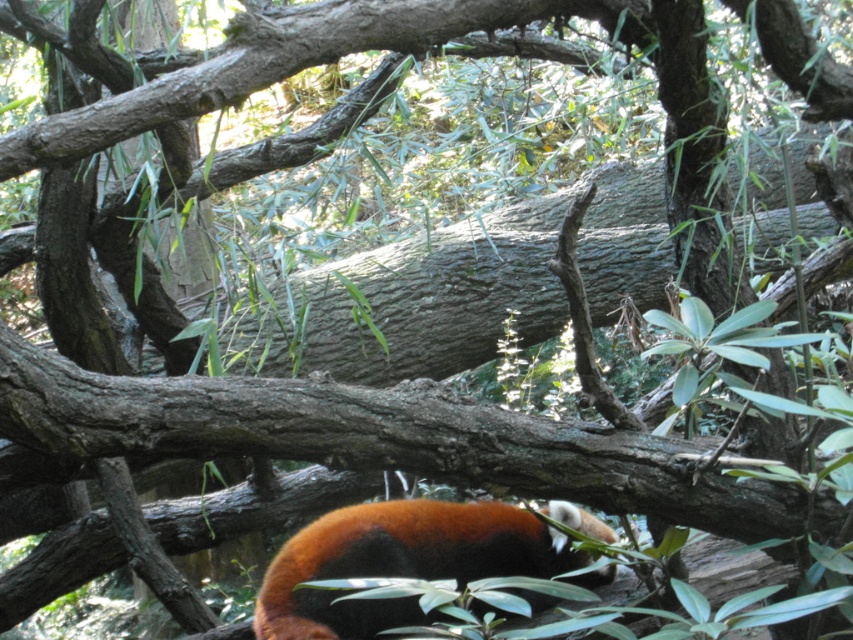
Question: Can you confirm if gray textured log at center is positioned to the left of fluffy orange-red fur at lower center?

Choices:
 (A) yes
 (B) no

Answer: (B)

Question: Does gray textured log at center have a greater width compared to fluffy orange-red fur at lower center?

Choices:
 (A) no
 (B) yes

Answer: (B)

Question: Which point is farther to the camera?

Choices:
 (A) gray textured log at center
 (B) fluffy orange-red fur at lower center

Answer: (A)

Question: Does gray textured log at center have a lesser width compared to fluffy orange-red fur at lower center?

Choices:
 (A) no
 (B) yes

Answer: (A)